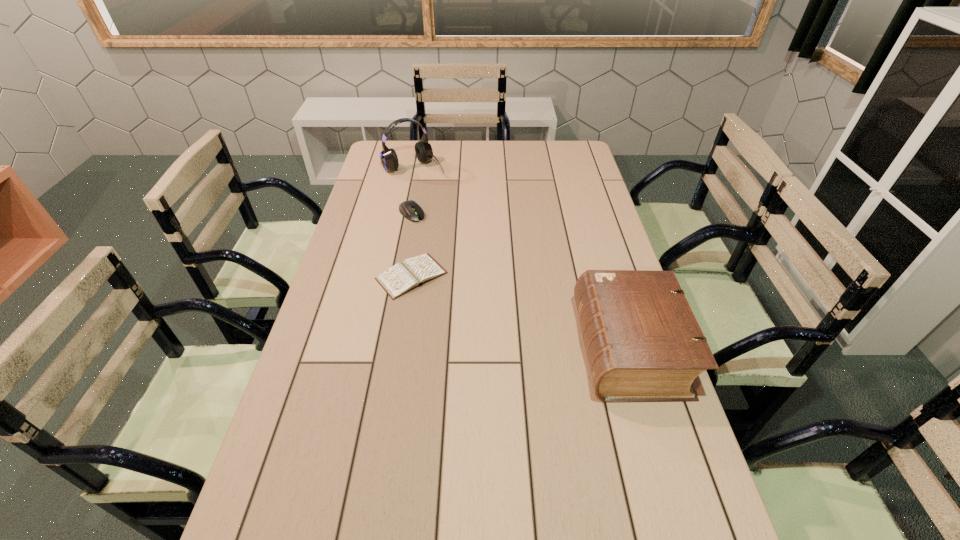
I want to click on vacant region at the near right corner of the desktop, so tap(699, 524).

The width and height of the screenshot is (960, 540). Find the location of `free area in between the tallest object and the third shortest object`. free area in between the tallest object and the third shortest object is located at coordinates (521, 258).

You are a GUI agent. You are given a task and a screenshot of the screen. Output one action in this format:
    pyautogui.click(x=<x>, y=<y>)
    Task: Click on the vacant space that is in between the second shortest object and the third farthest object
    This screenshot has width=960, height=540.
    Given the screenshot: What is the action you would take?
    point(412,245)

In order to click on blank region between the second farthest object and the headset in this screenshot , I will do `click(413, 191)`.

Where is `free space that is in between the farthest object and the Bible`? This screenshot has width=960, height=540. free space that is in between the farthest object and the Bible is located at coordinates (521, 258).

Locate an element on the screen. vacant region between the Bible and the tallest object is located at coordinates (521, 258).

The height and width of the screenshot is (540, 960). In order to click on free space between the second tallest object and the second farthest object in this screenshot , I will do tap(520, 281).

The height and width of the screenshot is (540, 960). Identify the location of free space between the shortest object and the second tallest object. (520, 312).

At what (x,y) coordinates should I click in order to perform the action: click on empty location between the nearest object and the third farthest object. Please return your answer as a coordinate pair (x, y). This screenshot has width=960, height=540. Looking at the image, I should click on (520, 312).

This screenshot has width=960, height=540. In order to click on unoccupied position between the shortest object and the Bible in this screenshot , I will do `click(520, 312)`.